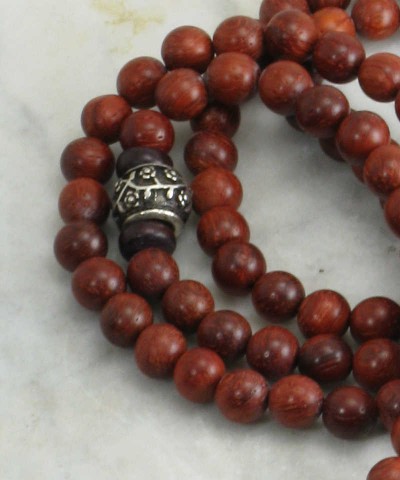
This screenshot has height=480, width=400. I want to click on decorative emblem on center piece of beads, so click(164, 187), click(150, 170), click(131, 197), click(181, 196), click(172, 176).